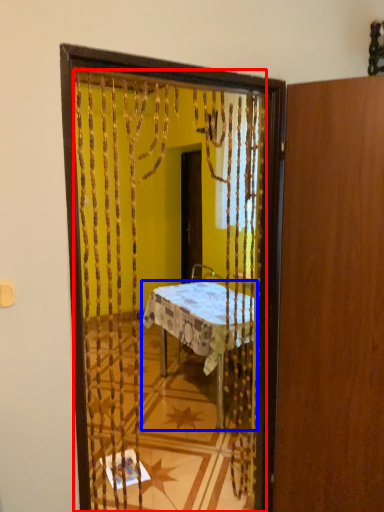
Question: Among these objects, which one is nearest to the camera, mirror (highlighted by a red box) or desk (highlighted by a blue box)?

Choices:
 (A) mirror
 (B) desk

Answer: (A)